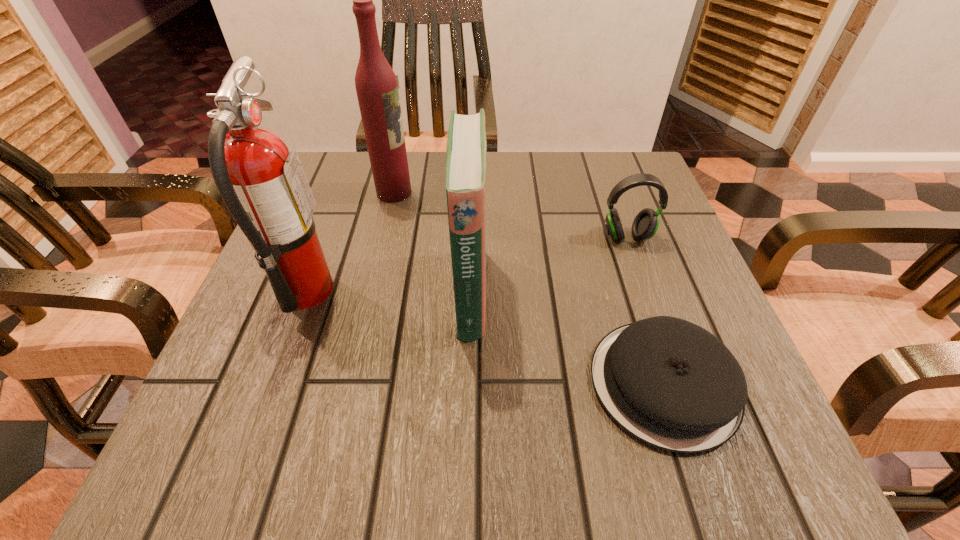
I want to click on blank area at the near edge, so click(x=474, y=469).

Locate an element on the screen. Image resolution: width=960 pixels, height=540 pixels. vacant space at the right edge is located at coordinates (661, 281).

In the image, there is a desktop. At what (x,y) coordinates should I click in order to perform the action: click on free region at the far left corner. Please return your answer as a coordinate pair (x, y). The height and width of the screenshot is (540, 960). Looking at the image, I should click on (365, 181).

In the image, there is a desktop. Where is `free region at the near left corner`? This screenshot has width=960, height=540. free region at the near left corner is located at coordinates (209, 456).

The image size is (960, 540). Identify the location of free space between the liquor and the leftmost object. (349, 241).

Identify the location of vacant space in between the third tallest object and the fire extinguisher. tap(388, 292).

The width and height of the screenshot is (960, 540). What are the coordinates of `free spot between the third tallest object and the shortest object` in the screenshot? It's located at click(x=567, y=338).

Identify the location of free point between the leftmost object and the third object from left to right. This screenshot has height=540, width=960. (388, 292).

What are the coordinates of `free space between the second object from left to right and the fourth tallest object` in the screenshot? It's located at (511, 214).

Image resolution: width=960 pixels, height=540 pixels. What are the coordinates of `free space between the fire extinguisher and the third shortest object` in the screenshot? It's located at (388, 292).